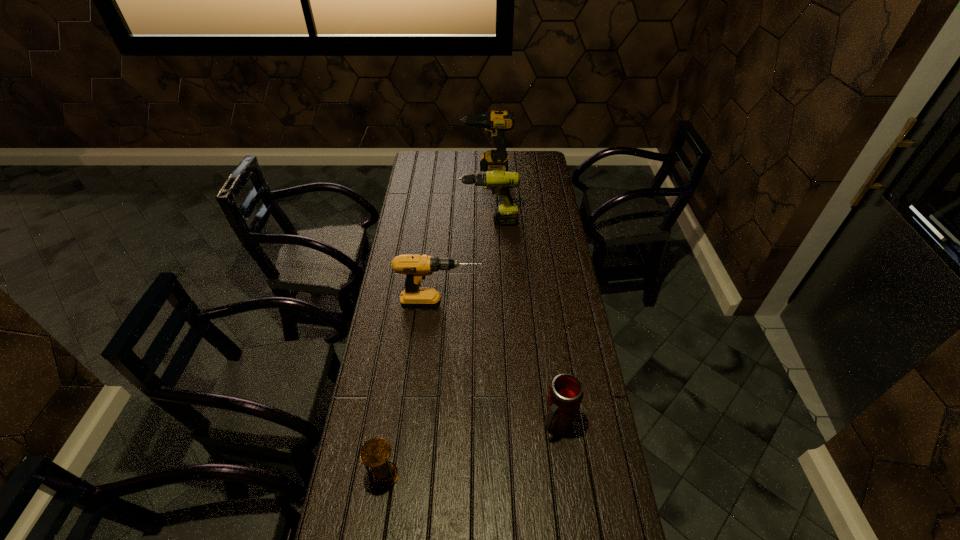
This screenshot has width=960, height=540. I want to click on vacant space situated 0.140m at the tip of the farthest object, so click(x=436, y=169).

Locate an element on the screen. The image size is (960, 540). free space located on the handle side of the fourth nearest object is located at coordinates (404, 222).

You are a GUI agent. You are given a task and a screenshot of the screen. Output one action in this format:
    pyautogui.click(x=<x>, y=<y>)
    Task: Click on the free space located 0.060m on the handle side of the fourth nearest object
    The width and height of the screenshot is (960, 540).
    Given the screenshot: What is the action you would take?
    pyautogui.click(x=447, y=222)

Locate an element on the screen. The width and height of the screenshot is (960, 540). vacant space located on the handle side of the fourth nearest object is located at coordinates (401, 222).

Find the location of a particular element. This screenshot has height=540, width=960. vacant space located at the tip of the third nearest object is located at coordinates (528, 305).

Where is `vacant point located on the side with the handle of the fourth farthest object`? This screenshot has width=960, height=540. vacant point located on the side with the handle of the fourth farthest object is located at coordinates (569, 518).

You are a GUI agent. You are given a task and a screenshot of the screen. Output one action in this format:
    pyautogui.click(x=<x>, y=<y>)
    Task: Click on the vacant space located 0.090m on the front of the shortest object
    The image size is (960, 540).
    Given the screenshot: What is the action you would take?
    pyautogui.click(x=377, y=526)

Locate an element on the screen. The image size is (960, 540). object present at the far edge is located at coordinates (495, 123).

The height and width of the screenshot is (540, 960). I want to click on drill positioned at the left edge, so click(416, 267).

I want to click on hourglass present at the left edge, so click(x=375, y=453).